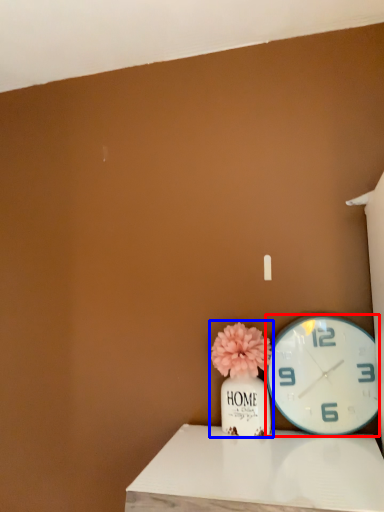
Question: Among these objects, which one is farthest to the camera, wall clock (highlighted by a red box) or floral arrangement (highlighted by a blue box)?

Choices:
 (A) wall clock
 (B) floral arrangement

Answer: (B)